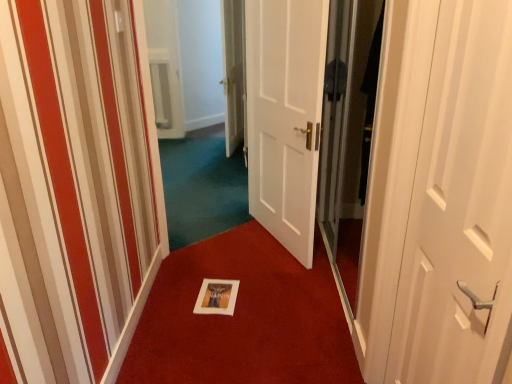
Question: Based on their sizes in the image, would you say white glossy door at center, which is counted as the third door, starting from the right, is bigger or smaller than transparent glass screen door at right?

Choices:
 (A) big
 (B) small

Answer: (A)

Question: Which is correct: white glossy door at center, which is the 1th door in back-to-front order, is inside transparent glass screen door at right, or outside of it?

Choices:
 (A) inside
 (B) outside

Answer: (B)

Question: Which object is the farthest from the white glossy door at center, which is counted as the third door, starting from the right?

Choices:
 (A) transparent glass screen door at right
 (B) white matte door at right, the 3th door viewed from the back
 (C) white paper at center
 (D) white matte door at center, which appears as the 2th door when viewed from the left

Answer: (B)

Question: Which is farther from the white glossy door at center, the third door viewed from the front?

Choices:
 (A) transparent glass screen door at right
 (B) white matte door at right, placed as the first door when sorted from right to left
 (C) white paper at center
 (D) white matte door at center, the 2th door when ordered from back to front

Answer: (B)